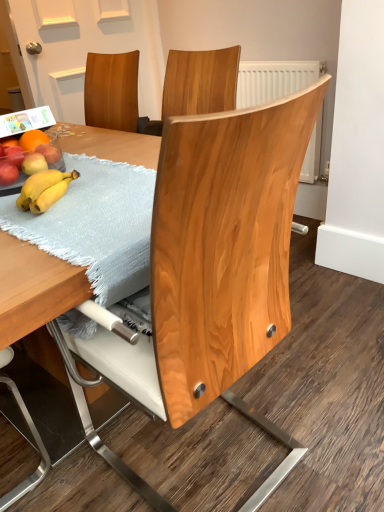
In order to click on vacant region to the right of matte red apple at left, arranged as the fourth apple when viewed from the back in this screenshot , I will do `click(91, 174)`.